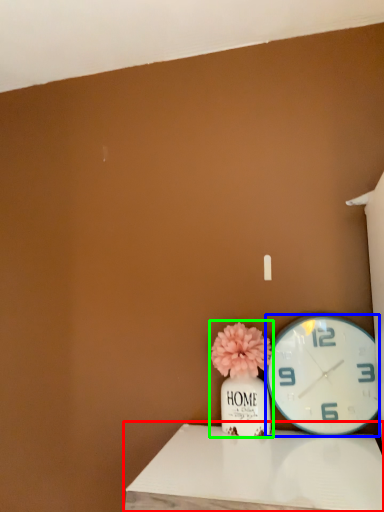
Question: Based on their relative distances, which object is nearer to table (highlighted by a red box)? Choose from wall clock (highlighted by a blue box) and floral arrangement (highlighted by a green box).

Choices:
 (A) wall clock
 (B) floral arrangement

Answer: (B)